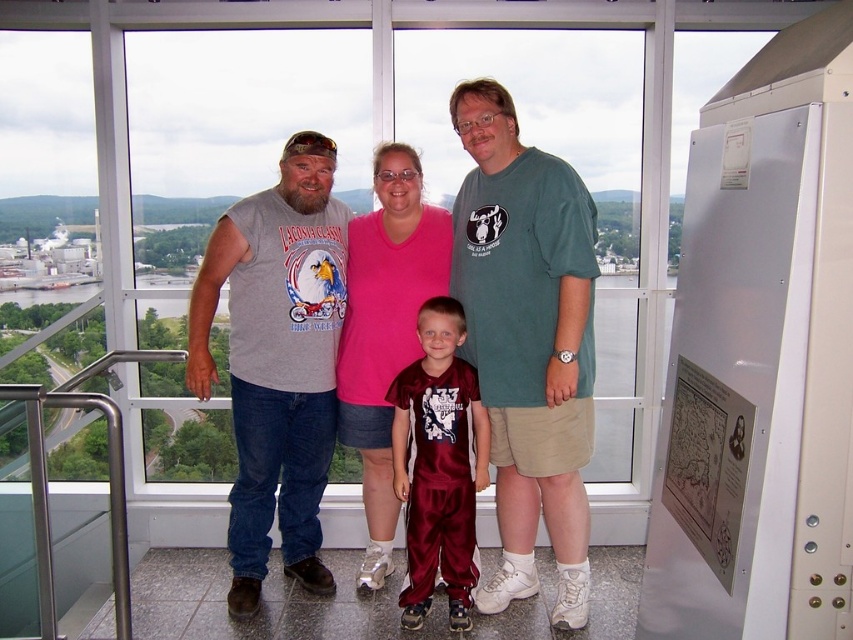
Question: Does matte gray t-shirt at center appear on the right side of transparent glass window at center?

Choices:
 (A) no
 (B) yes

Answer: (B)

Question: Among these objects, which one is farthest from the camera?

Choices:
 (A) transparent glass window at center
 (B) maroon jersey at center
 (C) green cotton t-shirt at center
 (D) maroon satin pants at center

Answer: (A)

Question: Is transparent glass window at center to the left of maroon satin pants at center from the viewer's perspective?

Choices:
 (A) yes
 (B) no

Answer: (A)

Question: Estimate the real-world distances between objects in this image. Which object is farther from the green cotton t-shirt at center?

Choices:
 (A) gray sleeveless shirt at center
 (B) maroon jersey at center

Answer: (A)

Question: Which point appears closest to the camera in this image?

Choices:
 (A) (461, 544)
 (B) (144, 392)
 (C) (582, 314)
 (D) (395, 314)

Answer: (C)

Question: Where is transparent glass window at center located in relation to maroon satin pants at center in the image?

Choices:
 (A) below
 (B) above

Answer: (B)